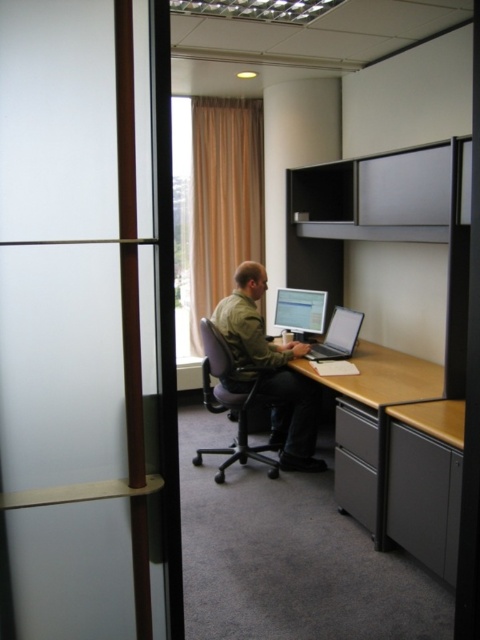
You are an office cleaner assigned to tidy up the desk in the cubicle. You need to place a new document organizer on the desk. Which object, the green matte jacket at center or the wooden at center, should you move first to make space?

The green matte jacket at center is positioned over wooden at center, so you should move the green matte jacket at center first to access the wooden at center underneath.

You are a delivery person who needs to place a small package on the desk between the purple fabric swivel chair at center and the matte black monitor at center. Which object should you place the package closer to so it doesn

→ The purple fabric swivel chair at center is closer to the viewer than the matte black monitor at center, so you should place the package closer to the purple fabric swivel chair at center to ensure it is easily accessible.